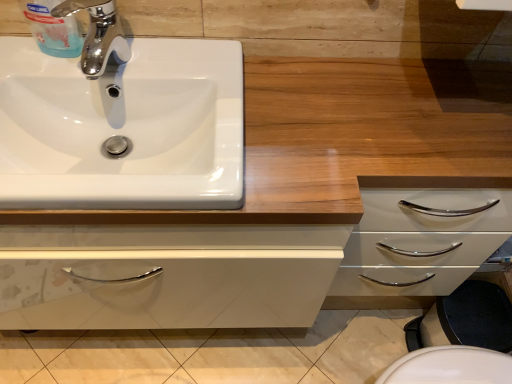
At what (x,y) coordinates should I click in order to perform the action: click on free spot to the right of chrome/metallic faucet at upper left. Please return your answer as a coordinate pair (x, y). The image size is (512, 384). Looking at the image, I should click on (187, 80).